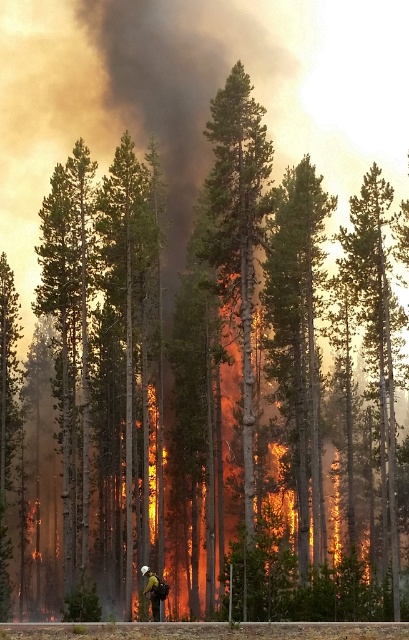
You are a firefighter trying to navigate through the forest fire scene. You see a green smooth tree at right and a hard hat helmet at center. Which object is taller?

The green smooth tree at right is taller than the hard hat helmet at center.

You are a firefighter assessing the forest fire scene. You notice two trees in the image, the green rough bark tree at center and the green smooth tree at right. Which tree is taller?

The green rough bark tree at center is taller than the green smooth tree at right.